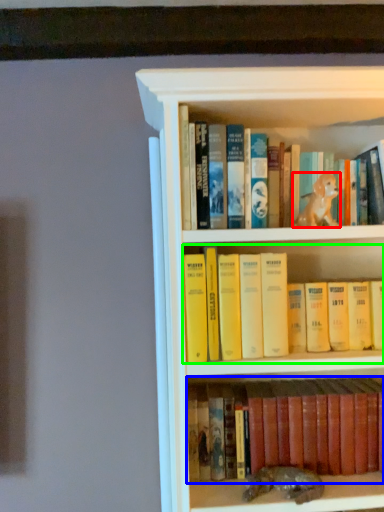
Question: Which object is positioned closest to animal (highlighted by a red box)? Select from book (highlighted by a blue box) and book (highlighted by a green box).

Choices:
 (A) book
 (B) book

Answer: (B)